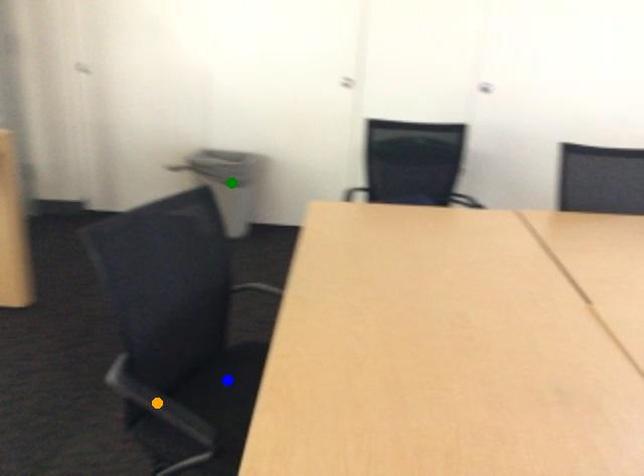
Order these from nearest to farthest:
A) orange point
B) blue point
C) green point

orange point, blue point, green point